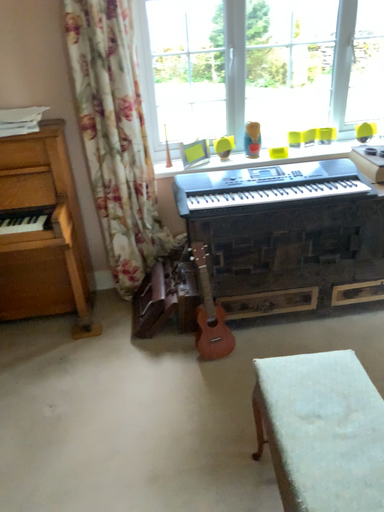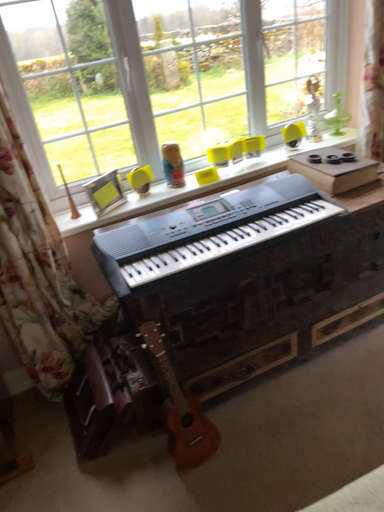
Question: Which way did the camera rotate in the video?

Choices:
 (A) rotated right
 (B) rotated left

Answer: (A)